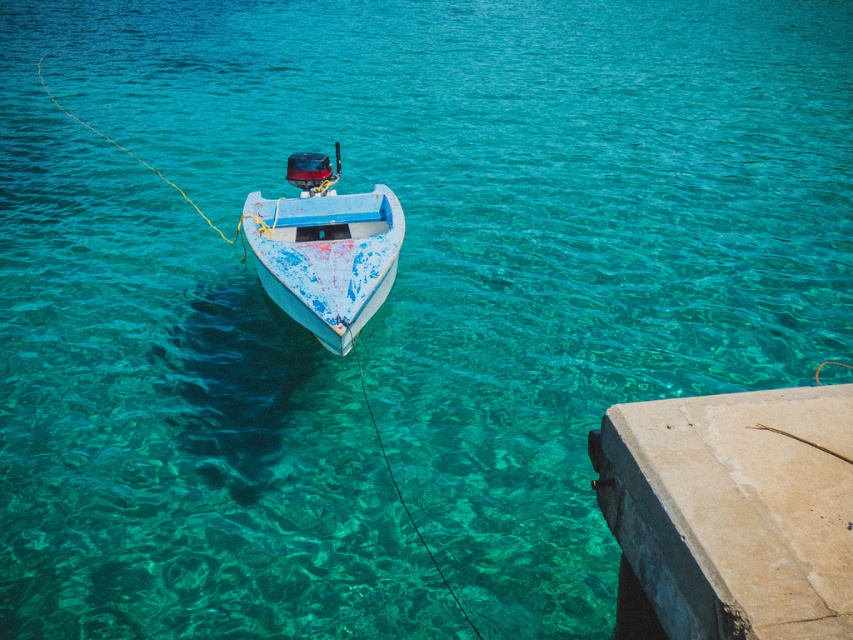
You are standing at the center of the image and want to walk to the concrete at lower right. Based on the coordinates provided, in which direction should you move relative to your current position?

The concrete at lower right is located at coordinates point (x=733, y=509), so you should move towards the lower right direction from your current position at the center.

You are standing on the concrete at lower right and want to board the painted wood boat at center. Is the boat directly in front of you or behind you?

The concrete at lower right is in front of painted wood boat at center, so the boat is behind you when you are on the concrete at lower right.